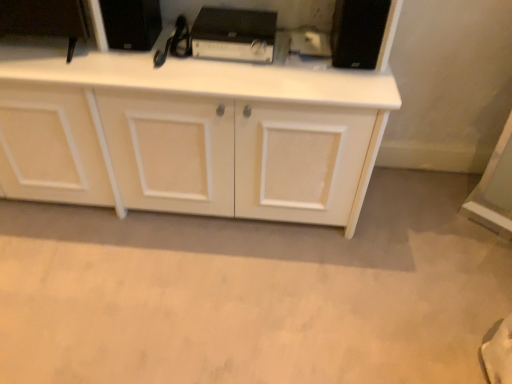
Question: In the image, is black matte speaker at upper right, the third appliance in the left-to-right sequence, positioned in front of or behind black plastic amplifier at center, which ranks as the 2th appliance in left-to-right order?

Choices:
 (A) front
 (B) behind

Answer: (A)

Question: Considering the positions of point (358, 39) and point (211, 39), is point (358, 39) closer or farther from the camera than point (211, 39)?

Choices:
 (A) closer
 (B) farther

Answer: (A)

Question: Estimate the real-world distances between objects in this image. Which object is farther from the white matte cabinet at center?

Choices:
 (A) black matte speaker at upper right, the third appliance in the left-to-right sequence
 (B) black matte speaker at upper center, which ranks as the third appliance in right-to-left order
 (C) black plastic amplifier at center, which ranks as the 2th appliance in left-to-right order

Answer: (A)

Question: Estimate the real-world distances between objects in this image. Which object is farther from the black plastic amplifier at center, which ranks as the 2th appliance in left-to-right order?

Choices:
 (A) black matte speaker at upper center, positioned as the 1th appliance in left-to-right order
 (B) black matte speaker at upper right, the third appliance in the left-to-right sequence
 (C) white matte cabinet at center

Answer: (C)